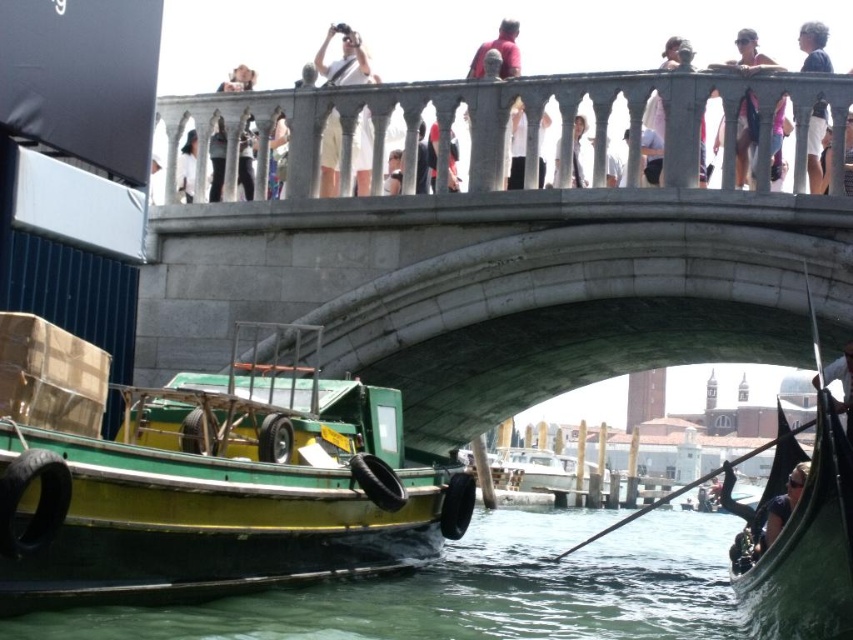
Question: Among these points, which one is nearest to the camera?

Choices:
 (A) (547, 64)
 (B) (248, 125)
 (C) (326, 36)
 (D) (780, 509)

Answer: (D)

Question: Which point appears closest to the camera in this image?

Choices:
 (A) (825, 365)
 (B) (231, 74)
 (C) (790, 502)
 (D) (125, 476)

Answer: (D)

Question: Is black glossy gondola at lower right above light blue denim shorts at upper right?

Choices:
 (A) no
 (B) yes

Answer: (A)

Question: Which point is farther from the camera taking this photo?

Choices:
 (A) (491, 513)
 (B) (183, 161)
 (C) (395, 12)
 (D) (779, 532)

Answer: (C)

Question: Is the position of light pink fabric at upper center more distant than that of light blue denim shorts at upper right?

Choices:
 (A) yes
 (B) no

Answer: (A)

Question: Does light brown leather jacket at upper center appear on the left side of white glossy paddle at lower right?

Choices:
 (A) no
 (B) yes

Answer: (B)